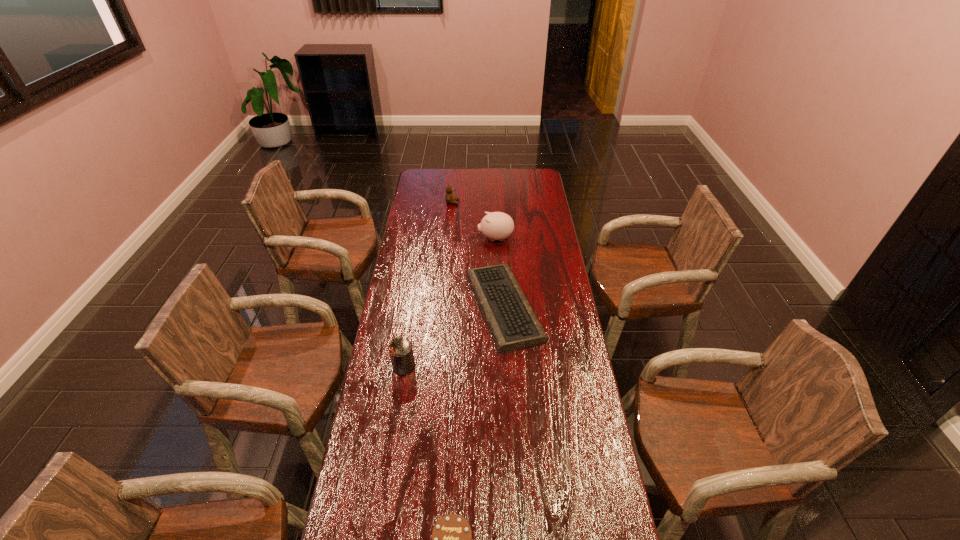
What are the coordinates of `piggy bank` in the screenshot? It's located at (497, 225).

This screenshot has height=540, width=960. In order to click on can in this screenshot , I will do `click(401, 352)`.

The image size is (960, 540). Find the location of `the leftmost object`. the leftmost object is located at coordinates (401, 352).

The image size is (960, 540). Identify the location of the farthest object. point(449,198).

Image resolution: width=960 pixels, height=540 pixels. I want to click on the third shortest object, so click(x=449, y=198).

At what (x,y) coordinates should I click in order to perform the action: click on the shortest object. Please return your answer as a coordinate pair (x, y). The height and width of the screenshot is (540, 960). Looking at the image, I should click on (512, 322).

The width and height of the screenshot is (960, 540). What are the coordinates of `the third farthest object` in the screenshot? It's located at (512, 322).

Where is `free region located at the snout of the piggy bank`? free region located at the snout of the piggy bank is located at coordinates (450, 239).

Locate an element on the screen. This screenshot has width=960, height=540. blank area located at the snout of the piggy bank is located at coordinates (432, 239).

At what (x,y) coordinates should I click in order to perform the action: click on free region located at the snout of the piggy bank. Please return your answer as a coordinate pair (x, y). Image resolution: width=960 pixels, height=540 pixels. Looking at the image, I should click on (411, 239).